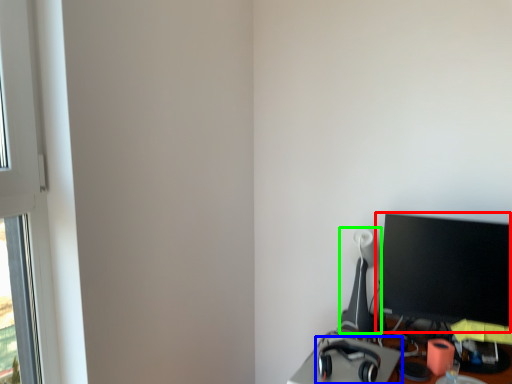
Question: Considering the real-world distances, which object is closest to computer monitor (highlighted by a red box)? headphones (highlighted by a blue box) or table lamp (highlighted by a green box).

Choices:
 (A) headphones
 (B) table lamp

Answer: (B)